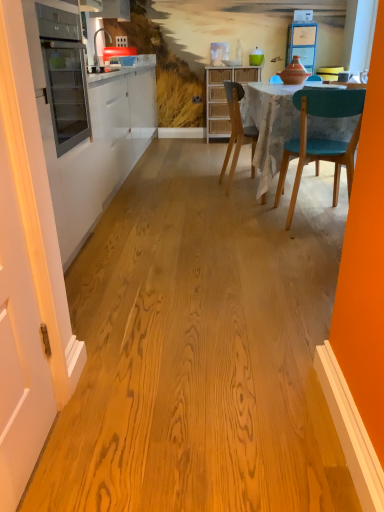
Question: From the image's perspective, is teal glossy vase at upper center positioned above or below matte gray chair at center?

Choices:
 (A) below
 (B) above

Answer: (B)

Question: Choose the correct answer: Is teal glossy vase at upper center inside matte gray chair at center or outside it?

Choices:
 (A) inside
 (B) outside

Answer: (B)

Question: Which object is positioned closest to the teal glossy vase at upper center?

Choices:
 (A) woven wood cabinet at center
 (B) white painted wood door at left
 (C) matte gray chair at center
 (D) matte glass oven at left

Answer: (A)

Question: Which of these objects is positioned farthest from the matte glass oven at left?

Choices:
 (A) white painted wood door at left
 (B) woven wood cabinet at center
 (C) teal glossy vase at upper center
 (D) matte gray chair at center

Answer: (C)